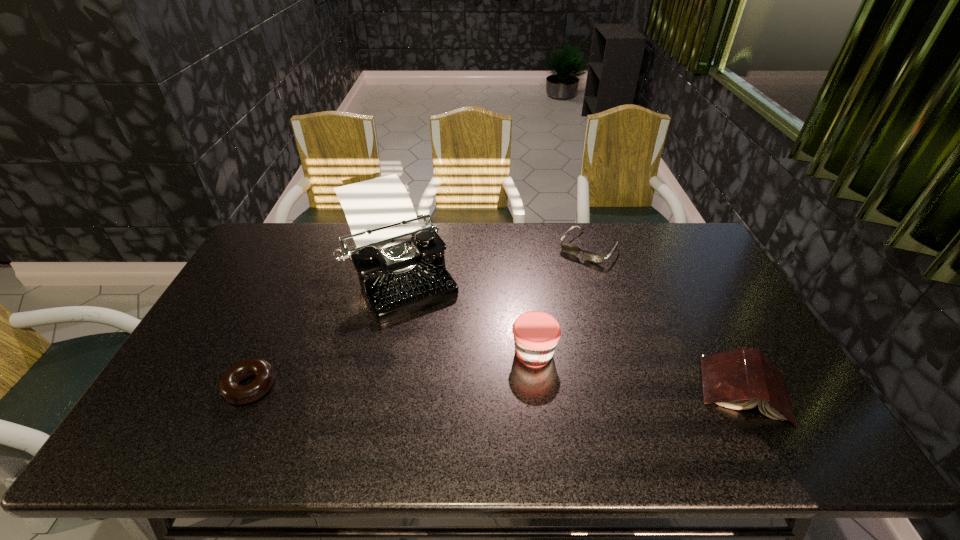
Where is `vacant point located between the sunglasses and the fourth object from right to left`? This screenshot has height=540, width=960. vacant point located between the sunglasses and the fourth object from right to left is located at coordinates (492, 259).

Locate an element on the screen. The image size is (960, 540). object that ranks as the second closest to the leftmost object is located at coordinates (536, 333).

Choose which object is the fourth nearest neighbor to the tallest object. Please provide its 2D coordinates. Your answer should be formatted as a tuple, i.e. [(x, y)], where the tuple contains the x and y coordinates of a point satisfying the conditions above.

[(739, 379)]

Find the location of a particular element. The width and height of the screenshot is (960, 540). vacant space that satisfies the following two spatial constraints: 1. on the back side of the third object from right to left; 2. on the right side of the leftmost object is located at coordinates (266, 353).

The height and width of the screenshot is (540, 960). I want to click on vacant space that satisfies the following two spatial constraints: 1. on the front side of the sunglasses; 2. on the right side of the book, so point(631,389).

The image size is (960, 540). I want to click on free point that satisfies the following two spatial constraints: 1. on the back side of the fourth object from left to right; 2. on the left side of the tallest object, so click(x=402, y=248).

Where is `free space that satisfies the following two spatial constraints: 1. on the front side of the third tallest object; 2. on the right side of the tallest object`? This screenshot has width=960, height=540. free space that satisfies the following two spatial constraints: 1. on the front side of the third tallest object; 2. on the right side of the tallest object is located at coordinates (372, 389).

Where is `free space that satisfies the following two spatial constraints: 1. on the back side of the second object from left to right; 2. on the left side of the leftmost object`? The image size is (960, 540). free space that satisfies the following two spatial constraints: 1. on the back side of the second object from left to right; 2. on the left side of the leftmost object is located at coordinates (304, 269).